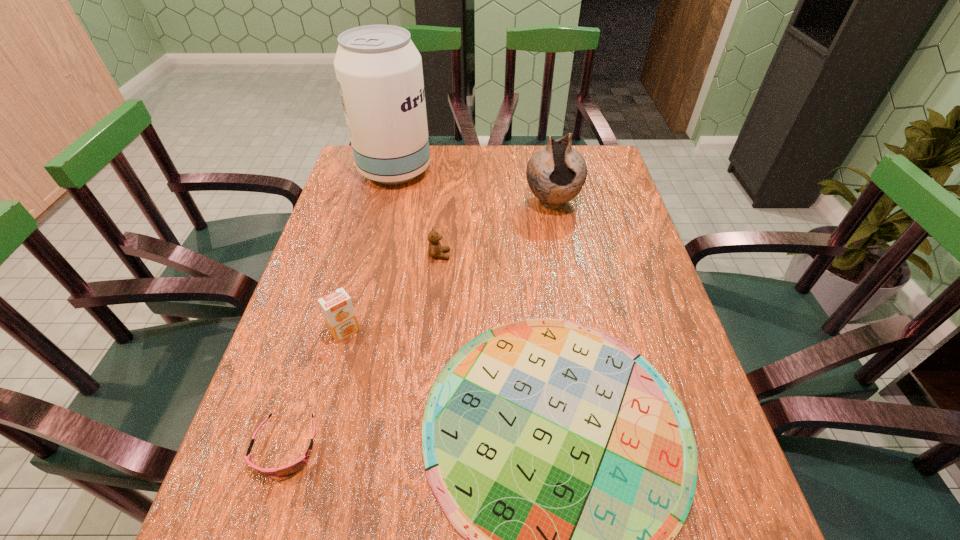
Find the location of `vacant space that is in between the fifth tallest object and the fourth shortest object`. vacant space that is in between the fifth tallest object and the fourth shortest object is located at coordinates (316, 389).

This screenshot has height=540, width=960. Identify the location of vacant space that's between the teddy bear and the third tallest object. coord(393,293).

Image resolution: width=960 pixels, height=540 pixels. Identify the location of vacant region between the third tallest object and the goggles. (316, 389).

Locate an element on the screen. The height and width of the screenshot is (540, 960). unoccupied position between the third tallest object and the fifth shortest object is located at coordinates (449, 267).

Where is `vacant region between the orange juice and the teddy bear`? The width and height of the screenshot is (960, 540). vacant region between the orange juice and the teddy bear is located at coordinates (393, 293).

Identify the location of the second closest object relative to the orange juice. (292, 468).

The width and height of the screenshot is (960, 540). What are the coordinates of `the fourth closest object to the orange juice` in the screenshot? It's located at (379, 72).

Locate an element on the screen. This screenshot has width=960, height=540. free region that satisfies the following two spatial constraints: 1. on the front-facing side of the third farthest object; 2. on the front side of the third tallest object is located at coordinates (433, 332).